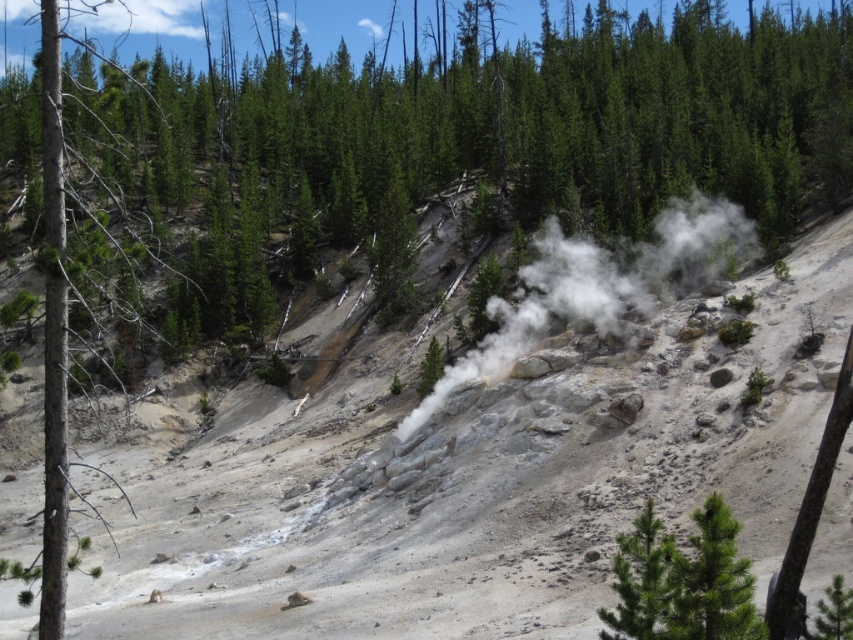
You are a hiker trying to determine the safest path to avoid the steam. Given the gray rocky hillside at center and the white steam at center, which object should you walk around to stay clear of the steam?

The gray rocky hillside at center is wider than the white steam at center, so you should walk around the gray rocky hillside at center to stay clear of the steam.

You are a hiker standing at the edge of the gray rocky hillside at center and looking towards the white steam at center. Which object is taller?

The gray rocky hillside at center is much taller than the white steam at center.